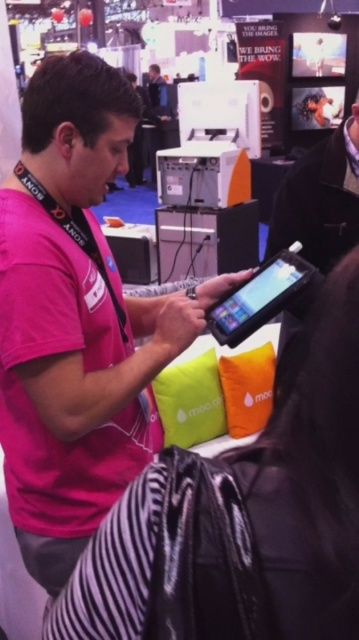
Question: Which is nearer to the matte green pillow at center?

Choices:
 (A) matte black tablet at center
 (B) pink matte shirt at center

Answer: (B)

Question: Is matte green pillow at center smaller than orange fabric pillow at center?

Choices:
 (A) yes
 (B) no

Answer: (B)

Question: Which is nearer to the matte green pillow at center?

Choices:
 (A) pink matte shirt at center
 (B) black plastic tablet at center

Answer: (A)

Question: Is matte black tablet at center bigger than black plastic tablet at center?

Choices:
 (A) no
 (B) yes

Answer: (A)

Question: Does pink matte shirt at center come in front of orange fabric pillow at center?

Choices:
 (A) yes
 (B) no

Answer: (A)

Question: Among these objects, which one is nearest to the camera?

Choices:
 (A) matte black tablet at center
 (B) pink matte shirt at center

Answer: (A)